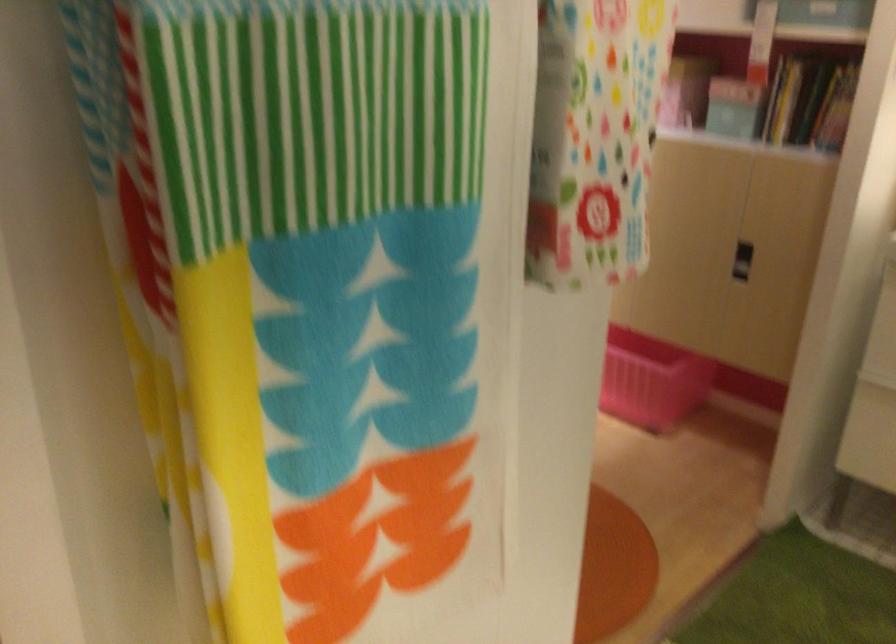
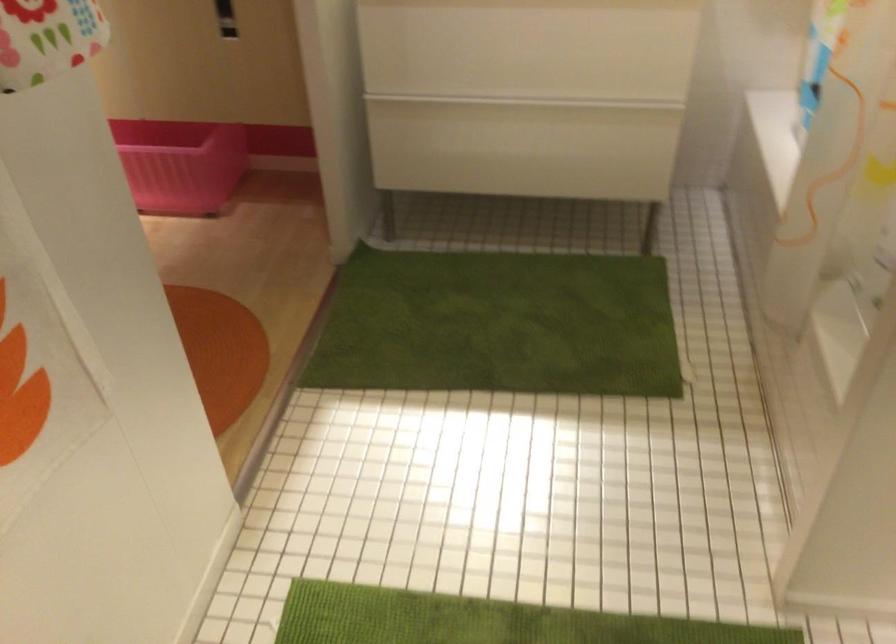
How did the camera likely rotate?

The camera rotated toward right-down.